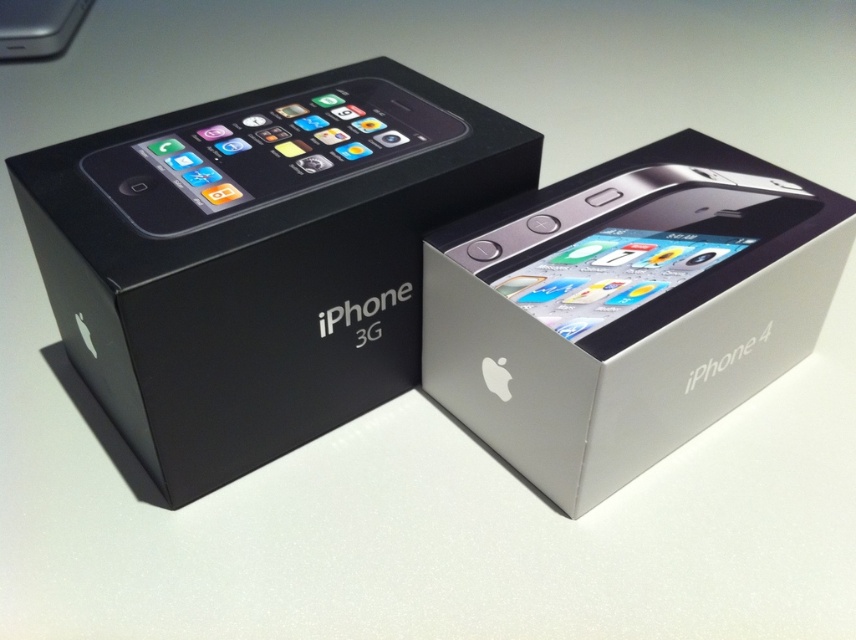
Between black matte iphone 3g box at left and silver metallic ipod at upper left, which one appears on the right side from the viewer's perspective?

Positioned to the right is black matte iphone 3g box at left.

Does black matte iphone 3g box at left have a greater width compared to silver metallic ipod at upper left?

Indeed, black matte iphone 3g box at left has a greater width compared to silver metallic ipod at upper left.

Identify the location of black matte iphone 3g box at left. Image resolution: width=856 pixels, height=640 pixels. (259, 257).

Can you confirm if matte black iphone at upper left is positioned to the left of silver metallic ipod at upper left?

In fact, matte black iphone at upper left is to the right of silver metallic ipod at upper left.

Is matte black iphone at upper left taller than silver metallic ipod at upper left?

Correct, matte black iphone at upper left is much taller as silver metallic ipod at upper left.

At what (x,y) coordinates should I click in order to perform the action: click on matte black iphone at upper left. Please return your answer as a coordinate pair (x, y). This screenshot has width=856, height=640. Looking at the image, I should click on (265, 154).

Does point (312, 172) come in front of point (651, 401)?

No, it is behind (651, 401).

Between black matte iphone 3g box at left and silver metallic iphone 4 at center, which one has less height?

silver metallic iphone 4 at center is shorter.

Locate an element on the screen. The height and width of the screenshot is (640, 856). black matte iphone 3g box at left is located at coordinates (259, 257).

Where is `black matte iphone 3g box at left`? The width and height of the screenshot is (856, 640). black matte iphone 3g box at left is located at coordinates (259, 257).